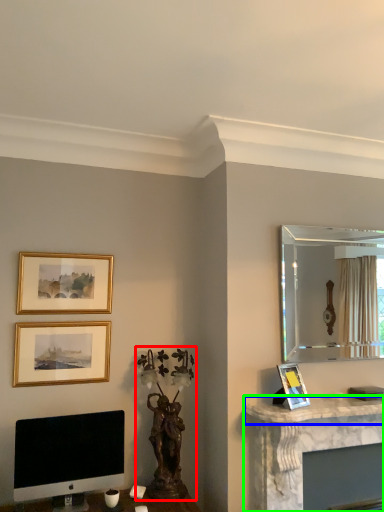
Question: Estimate the real-world distances between objects in this image. Which object is farther from sculpture (highlighted by a red box), counter top (highlighted by a blue box) or computer desk (highlighted by a green box)?

Choices:
 (A) counter top
 (B) computer desk

Answer: (B)